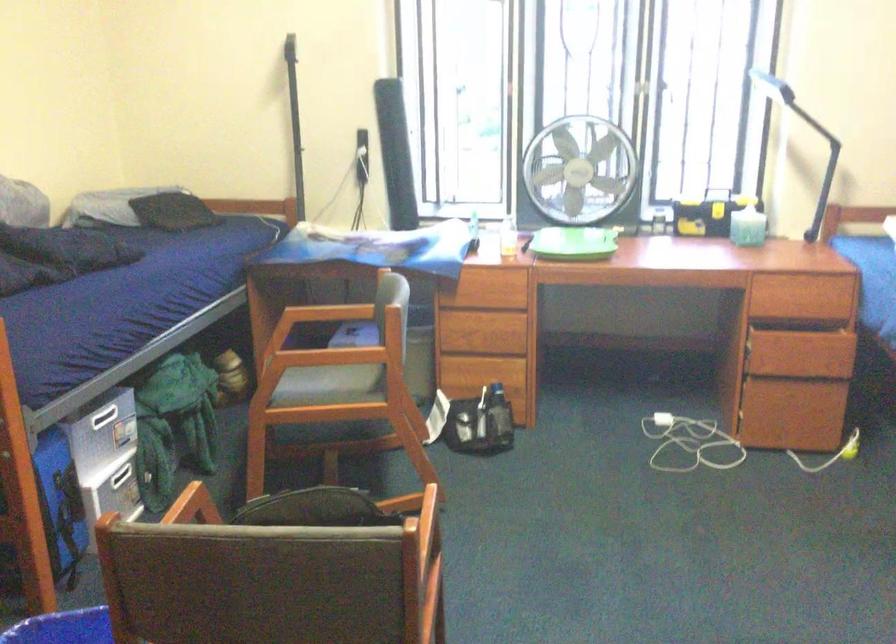
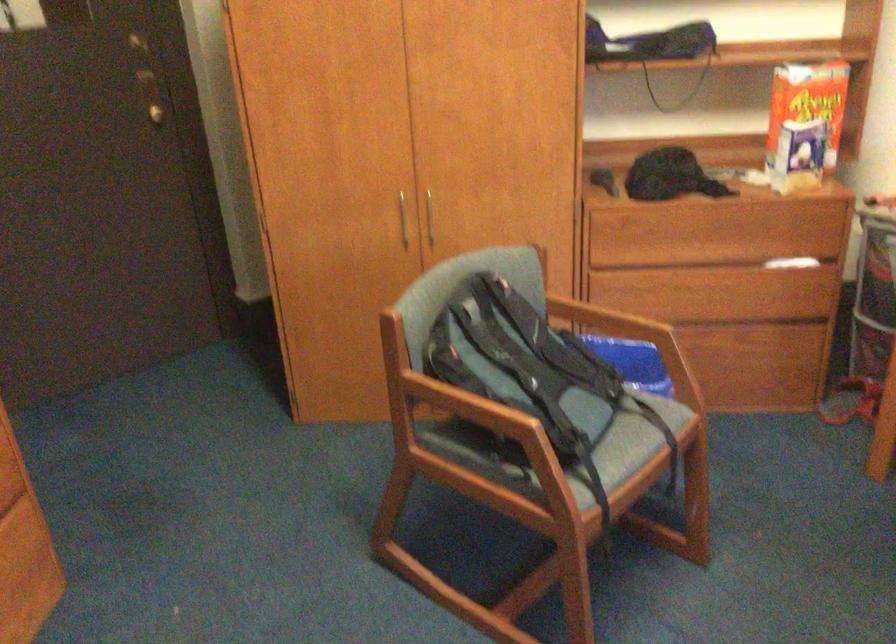
Find the pixel in the second image that matches [134,549] in the first image.

(609, 325)